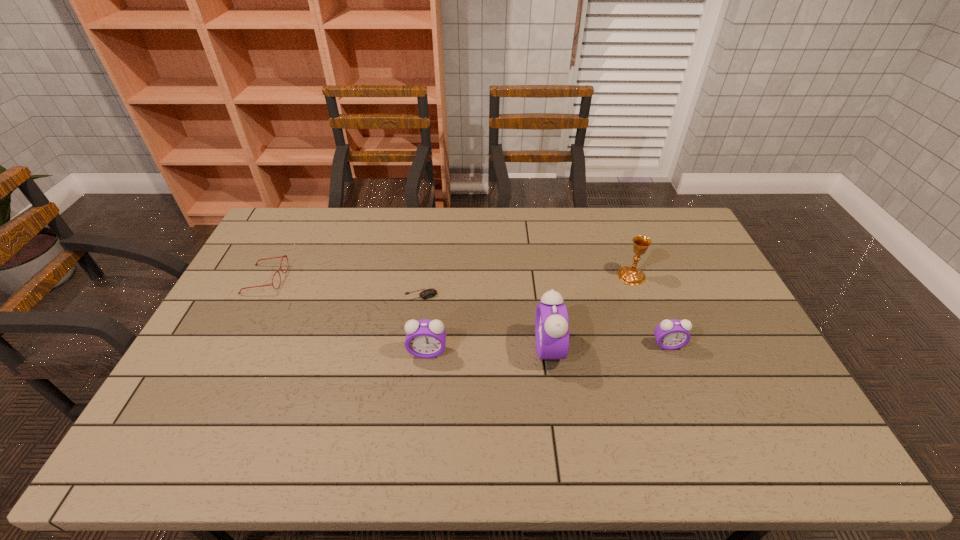
You are a GUI agent. You are given a task and a screenshot of the screen. Output one action in this format:
    pyautogui.click(x=<x>, y=<y>)
    Task: Click on the blank space at the near edge of the desktop
    Image resolution: width=960 pixels, height=540 pixels.
    Given the screenshot: What is the action you would take?
    pyautogui.click(x=497, y=408)

This screenshot has height=540, width=960. Find the location of `vacant space at the left edge of the desktop`. vacant space at the left edge of the desktop is located at coordinates (190, 362).

This screenshot has height=540, width=960. Identify the location of vacant space at the right edge of the desktop. (689, 301).

Image resolution: width=960 pixels, height=540 pixels. I want to click on free location at the far left corner of the desktop, so click(314, 218).

Image resolution: width=960 pixels, height=540 pixels. I want to click on free point between the spectacles and the chalice, so click(x=448, y=278).

The width and height of the screenshot is (960, 540). What are the coordinates of `free space between the mouse and the tallest object` in the screenshot? It's located at (485, 321).

Identify the location of free space between the shortest object and the fourth object from left to right. This screenshot has width=960, height=540. (485, 321).

At what (x,y) coordinates should I click in order to perform the action: click on blank region between the fourth object from left to right and the leftmost object. Please return your answer as a coordinate pair (x, y). Looking at the image, I should click on (407, 314).

Locate an element on the screen. This screenshot has height=540, width=960. vacant space that's between the rightmost alarm clock and the chalice is located at coordinates (650, 310).

The height and width of the screenshot is (540, 960). Identify the location of object that can be found as the second closest to the second shortest alarm clock. (551, 321).